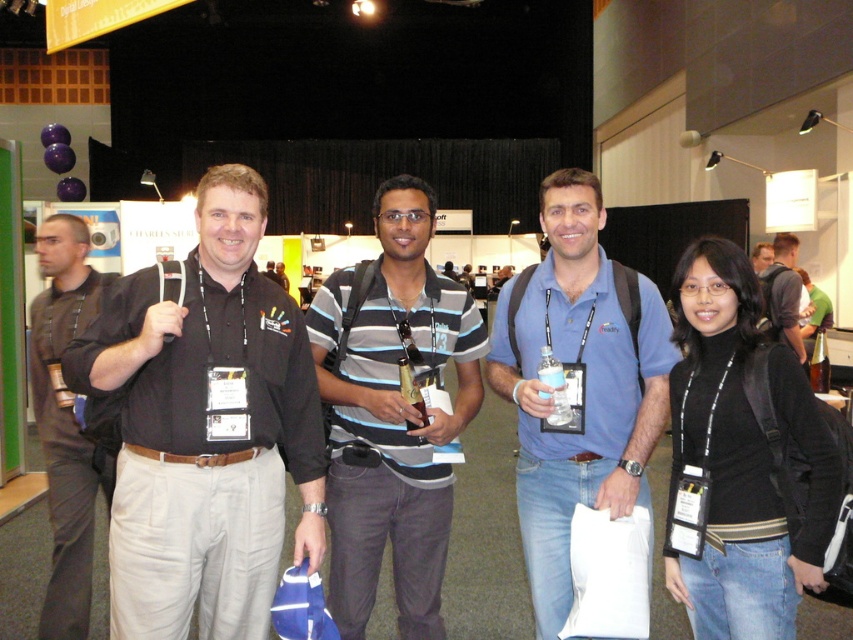
Question: Where is black matte turtleneck at center located in relation to black striped shirt at center in the image?

Choices:
 (A) left
 (B) right

Answer: (A)

Question: Which point is farther to the camera?

Choices:
 (A) striped cotton shirt at center
 (B) black cotton shirt at left
 (C) blue cotton polo shirt at center
 (D) black striped shirt at center

Answer: (D)

Question: Which point appears farthest from the camera in this image?

Choices:
 (A) (228, 474)
 (B) (780, 240)
 (C) (360, 403)

Answer: (B)

Question: Which object is closer to the camera taking this photo?

Choices:
 (A) blue cotton polo shirt at center
 (B) black matte turtleneck at center
 (C) black cotton shirt at center

Answer: (C)

Question: Is black matte turtleneck at center above black striped shirt at center?

Choices:
 (A) no
 (B) yes

Answer: (A)

Question: Is striped cotton shirt at center positioned at the back of black matte turtleneck at center?

Choices:
 (A) no
 (B) yes

Answer: (B)